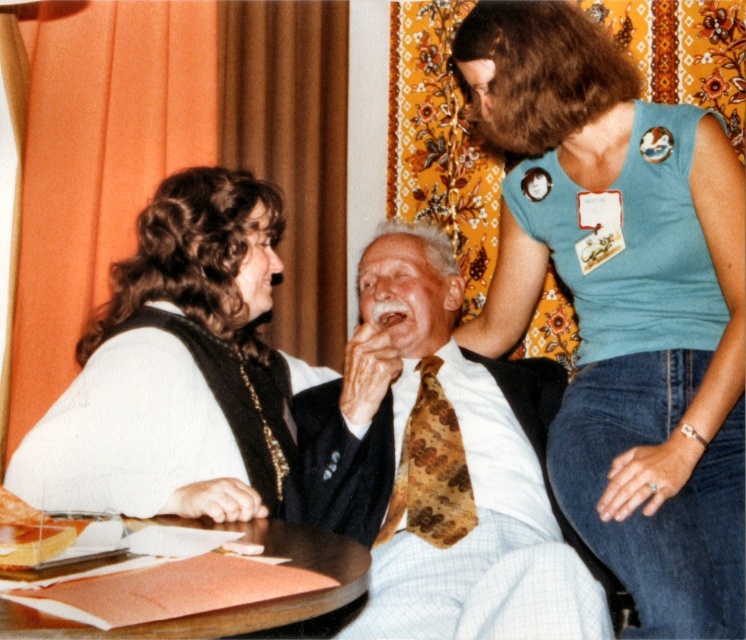
Who is more forward, (401, 528) or (203, 284)?

Point (401, 528) is in front.

Is floral tie at center to the right of white fuzzy vest at left from the viewer's perspective?

Yes, floral tie at center is to the right of white fuzzy vest at left.

Is point (473, 516) in front of point (125, 499)?

No, it is behind (125, 499).

The image size is (746, 640). In order to click on floral tie at center in this screenshot , I will do (441, 467).

Who is taller, white fuzzy vest at left or smooth brown paper at lower center?

white fuzzy vest at left is taller.

Is point (192, 230) more distant than point (251, 524)?

Yes, it is.

The image size is (746, 640). What are the coordinates of `white fuzzy vest at left` in the screenshot? It's located at (181, 371).

Is the position of floral tie at center less distant than that of smooth brown paper at lower center?

No, it is not.

In the scene shown: Can you confirm if floral tie at center is bigger than smooth brown paper at lower center?

Correct, floral tie at center is larger in size than smooth brown paper at lower center.

Is point (542, 541) positioned behind point (231, 627)?

Yes, point (542, 541) is farther from viewer.

At what (x,y) coordinates should I click in order to perform the action: click on floral tie at center. Please return your answer as a coordinate pair (x, y). Looking at the image, I should click on (441, 467).